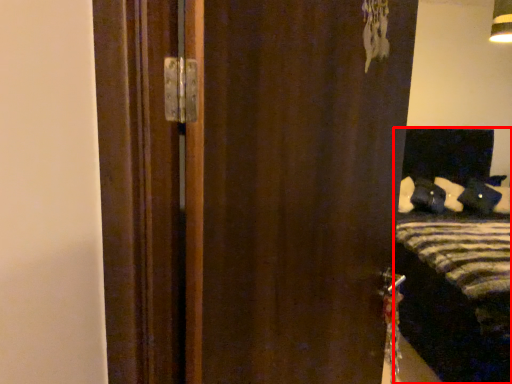
Question: From the image's perspective, where is bed (annotated by the red box) located in relation to door in the image?

Choices:
 (A) above
 (B) below

Answer: (B)